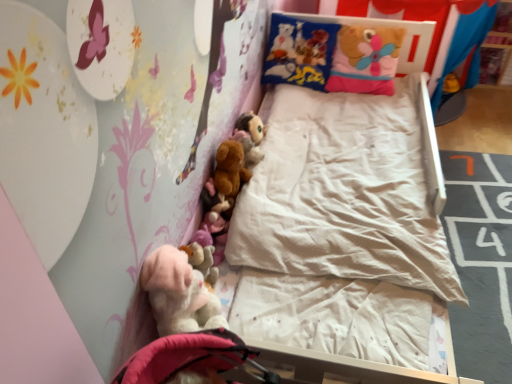
Question: From the image's perspective, is fuzzy brown plush at upper center, the 1th toy from the back, under soft plush pillow at upper right?

Choices:
 (A) no
 (B) yes

Answer: (B)

Question: Is fuzzy brown plush at upper center, acting as the third toy starting from the front, looking in the opposite direction of soft plush pillow at upper right?

Choices:
 (A) yes
 (B) no

Answer: (B)

Question: From a real-world perspective, does fuzzy brown plush at upper center, which ranks as the third toy in bottom-to-top order, stand above soft plush pillow at upper right?

Choices:
 (A) no
 (B) yes

Answer: (A)

Question: Is fuzzy brown plush at upper center, the 1th toy from the back, outside of soft plush pillow at upper right?

Choices:
 (A) yes
 (B) no

Answer: (A)

Question: Is fuzzy brown plush at upper center, acting as the third toy starting from the front, shorter than soft plush pillow at upper right?

Choices:
 (A) yes
 (B) no

Answer: (A)

Question: From the image's perspective, is fuzzy brown plush at upper center, acting as the third toy starting from the front, above soft plush pillow at upper right?

Choices:
 (A) yes
 (B) no

Answer: (B)

Question: Does fuzzy brown plush at upper center, acting as the third toy starting from the front, turn towards brown plush toy at center, which is the 2th toy from front to back?

Choices:
 (A) yes
 (B) no

Answer: (B)

Question: Is fuzzy brown plush at upper center, the 1th toy from the back, positioned in front of brown plush toy at center, the 2th toy positioned from the back?

Choices:
 (A) no
 (B) yes

Answer: (A)

Question: Does fuzzy brown plush at upper center, which ranks as the third toy in bottom-to-top order, have a lesser width compared to brown plush toy at center, the 2th toy positioned from the back?

Choices:
 (A) yes
 (B) no

Answer: (A)

Question: Would you consider fuzzy brown plush at upper center, marked as the 1th toy in a top-to-bottom arrangement, to be distant from brown plush toy at center, which is the second toy in bottom-to-top order?

Choices:
 (A) no
 (B) yes

Answer: (A)

Question: Is fuzzy brown plush at upper center, marked as the 1th toy in a top-to-bottom arrangement, wider than brown plush toy at center, which is the second toy in bottom-to-top order?

Choices:
 (A) no
 (B) yes

Answer: (A)

Question: Is fuzzy brown plush at upper center, which ranks as the third toy in bottom-to-top order, surrounding brown plush toy at center, which is the 2th toy from front to back?

Choices:
 (A) yes
 (B) no

Answer: (B)

Question: From a real-world perspective, is fuzzy brown plush at upper center, marked as the 1th toy in a top-to-bottom arrangement, physically above fluffy pink teddy at lower left?

Choices:
 (A) no
 (B) yes

Answer: (A)